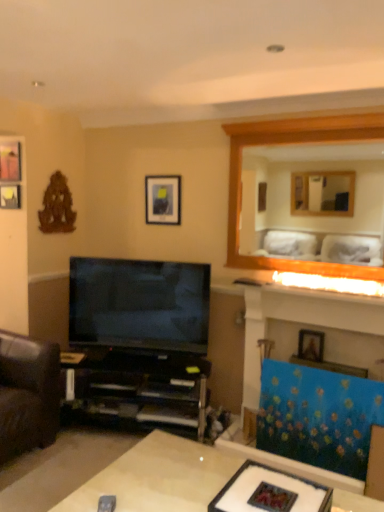
Question: From the image's perspective, is white glossy table at lower center positioned above or below wooden mirror at upper right?

Choices:
 (A) above
 (B) below

Answer: (B)

Question: Based on their sizes in the image, would you say white glossy table at lower center is bigger or smaller than wooden mirror at upper right?

Choices:
 (A) small
 (B) big

Answer: (B)

Question: Considering the real-world distances, which object is farthest from the wooden picture frame at upper right, which ranks as the first picture frame in bottom-to-top order?

Choices:
 (A) matte glass frame at center
 (B) matte black picture frame at upper center, which is counted as the 3th picture frame, starting from the left
 (C) black plastic shelf at lower left
 (D) matte black picture frame at upper left, arranged as the third picture frame when viewed from the right
 (E) white glossy table at lower center

Answer: (D)

Question: Which object is the farthest from the white glossy table at lower center?

Choices:
 (A) matte black picture frame at upper left, which is the third picture frame in front-to-back order
 (B) matte black picture frame at upper left, the third picture frame positioned from the back
 (C) black plastic shelf at lower left
 (D) matte glass frame at center
 (E) wooden picture frame at upper right, marked as the 1th picture frame in a front-to-back arrangement

Answer: (B)